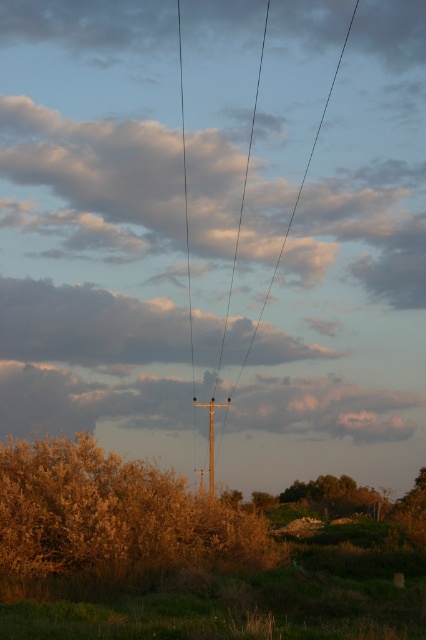
Consider the image. Does cloudy sky at center appear on the left side of smooth wood telegraph pole at center?

Yes, cloudy sky at center is to the left of smooth wood telegraph pole at center.

Which is below, cloudy sky at center or smooth wood telegraph pole at center?

smooth wood telegraph pole at center is below.

The image size is (426, 640). Identify the location of cloudy sky at center. (86, 400).

Is point (72, 513) closer to camera compared to point (339, 61)?

Yes, point (72, 513) is in front of point (339, 61).

Is brown leafy bush at lower left below black wire at center?

Yes.

The image size is (426, 640). What do you see at coordinates (111, 522) in the screenshot? I see `brown leafy bush at lower left` at bounding box center [111, 522].

Where is `brown leafy bush at lower left`? The width and height of the screenshot is (426, 640). brown leafy bush at lower left is located at coordinates (111, 522).

Can you confirm if cloudy sky at upper center is thinner than black wire at center?

In fact, cloudy sky at upper center might be wider than black wire at center.

Can you confirm if cloudy sky at upper center is positioned below black wire at center?

Yes.

The height and width of the screenshot is (640, 426). I want to click on cloudy sky at upper center, so click(x=88, y=324).

Locate an element on the screen. The width and height of the screenshot is (426, 640). cloudy sky at upper center is located at coordinates (88, 324).